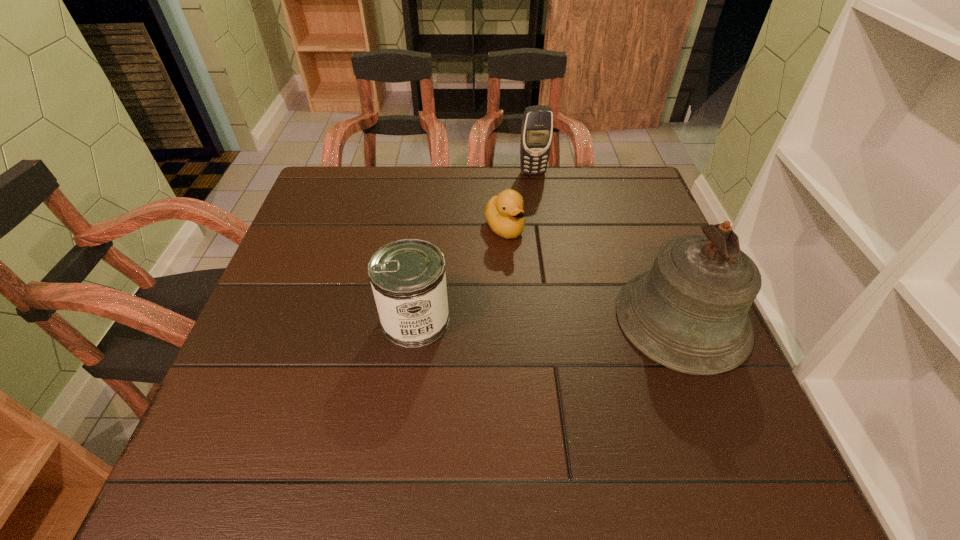
At what (x,y) coordinates should I click in order to perform the action: click on the leftmost object. Please return your answer as a coordinate pair (x, y). The image size is (960, 540). Looking at the image, I should click on (408, 279).

In order to click on can in this screenshot , I will do `click(408, 279)`.

The width and height of the screenshot is (960, 540). Find the location of `bell`. bell is located at coordinates (x=688, y=313).

Where is `the rightmost object`? The width and height of the screenshot is (960, 540). the rightmost object is located at coordinates 688,313.

Where is `the third shortest object`? This screenshot has height=540, width=960. the third shortest object is located at coordinates tap(537, 126).

At what (x,y) coordinates should I click in order to perform the action: click on the farthest object. Please return your answer as a coordinate pair (x, y). Image resolution: width=960 pixels, height=540 pixels. Looking at the image, I should click on (537, 126).

Identify the location of the shortest object. This screenshot has width=960, height=540. (504, 213).

Locate an element on the screen. Image resolution: width=960 pixels, height=540 pixels. the second farthest object is located at coordinates (504, 213).

The height and width of the screenshot is (540, 960). I want to click on free location located on the right of the can, so click(615, 320).

The image size is (960, 540). Identify the location of free spot located 0.320m on the left of the tallest object. (466, 319).